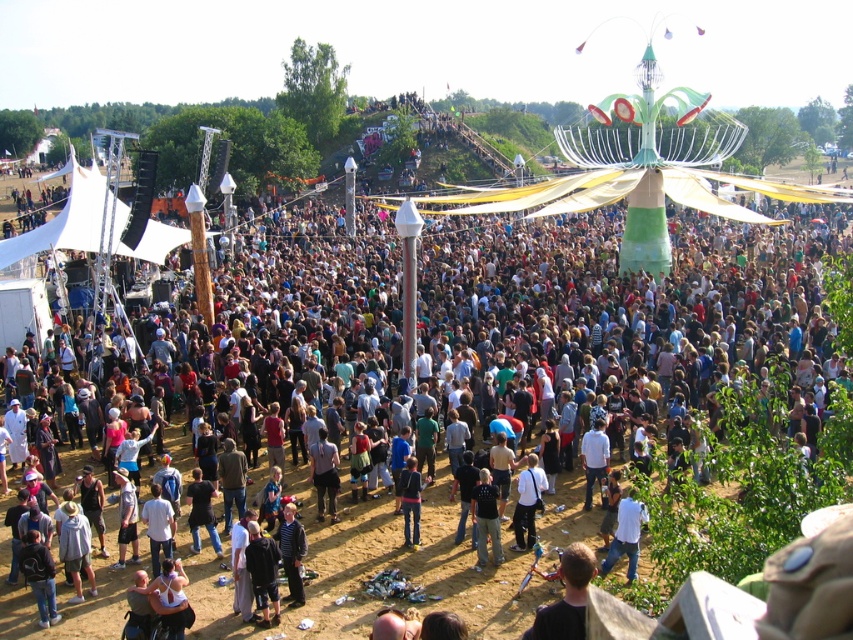
Question: Is dark gray hoodie at center positioned behind dark blue jeans at center?

Choices:
 (A) no
 (B) yes

Answer: (A)

Question: Estimate the real-world distances between objects in this image. Which object is farther from the dark gray fabric pants at lower center?

Choices:
 (A) white matte shirt at center
 (B) dark gray hoodie at center
 (C) black matte shirt at center
 (D) dark blue jeans at center

Answer: (B)

Question: Which point is closer to the camera taking this photo?

Choices:
 (A) (535, 534)
 (B) (200, 353)
 (C) (318, 513)
 (D) (479, 538)

Answer: (D)

Question: Does black matte shirt at center have a greater width compared to dark gray fabric pants at lower center?

Choices:
 (A) yes
 (B) no

Answer: (B)

Question: Does black matte shirt at center appear under white matte shirt at center?

Choices:
 (A) no
 (B) yes

Answer: (B)

Question: Which of the following is the farthest from the observer?

Choices:
 (A) (332, 499)
 (B) (531, 480)
 (C) (415, 532)

Answer: (A)